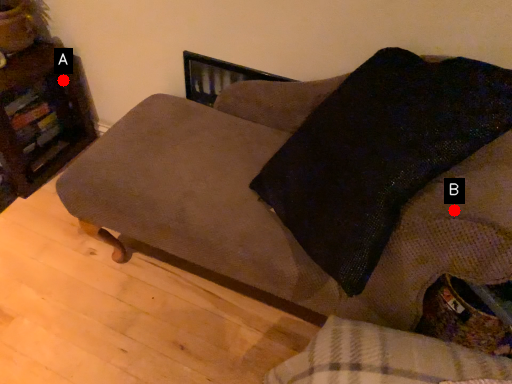
Question: Two points are circled on the image, labeled by A and B beside each circle. Which point is further to the camera?

Choices:
 (A) A is further
 (B) B is further

Answer: (A)